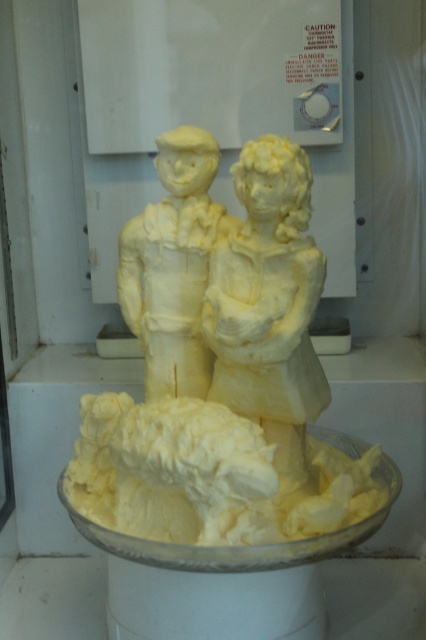
In the scene shown: Based on the provided scene description, where is the white creamy icing at lower center located in terms of its 2D coordinates?

The white creamy icing at lower center is located at the 2D coordinates point (206, 476).

You are a chef who needs to place a new dessert on the glass plate where the yellow butter sculpture at center is currently displayed. However, there is white creamy icing at lower center already on the plate. Can you fit the dessert on the plate without overlapping the existing icing?

The white creamy icing at lower center is located below the yellow butter sculpture at center, so there might still be space above or to the sides of the white creamy icing at lower center to place the new dessert without overlapping it. However, the exact positioning would depend on the size and shape of the dessert.